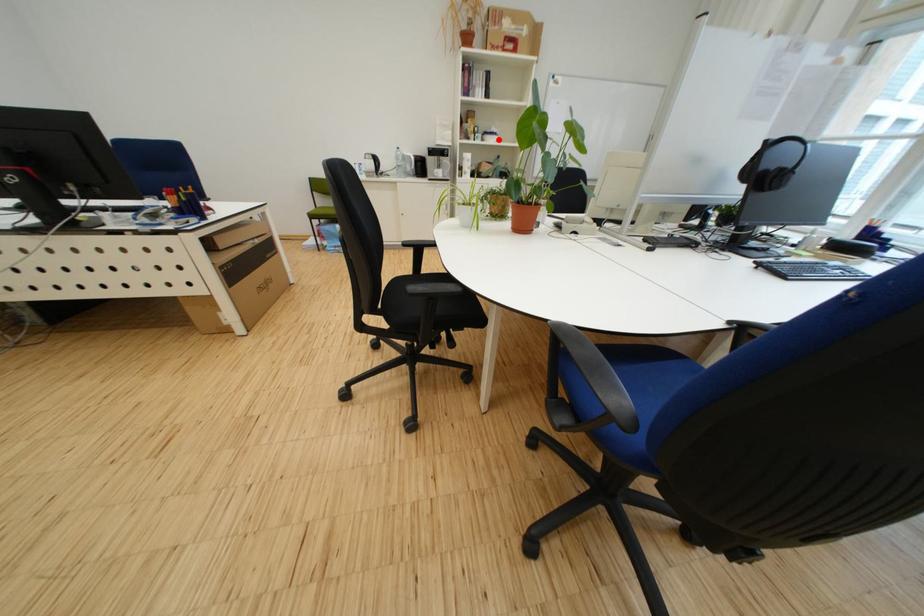
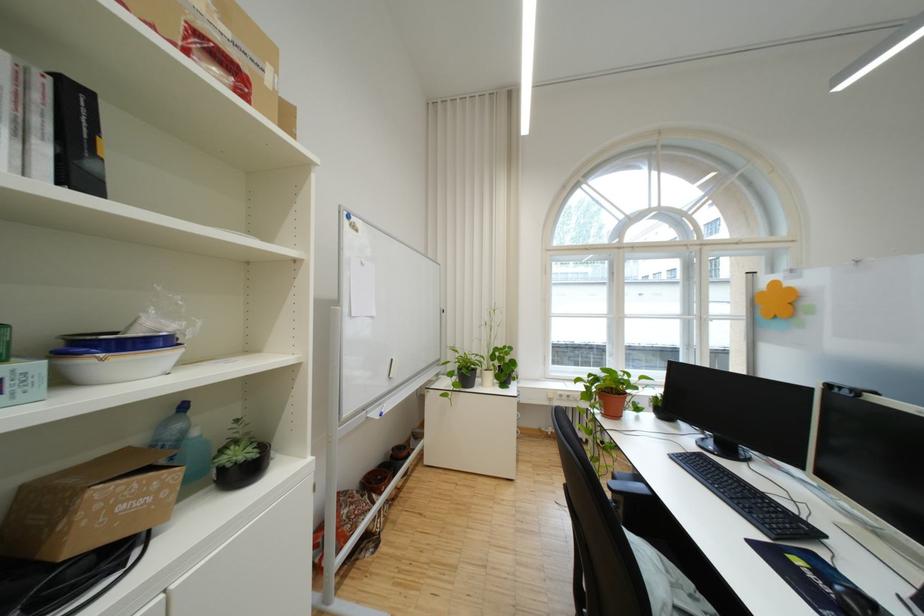
Question: I am providing you with two images of the same scene from different viewpoints. Given a red point in image1, look at the same physical point in image2. Is it:

Choices:
 (A) Closer to the viewpoint
 (B) Farther from the viewpoint

Answer: (B)